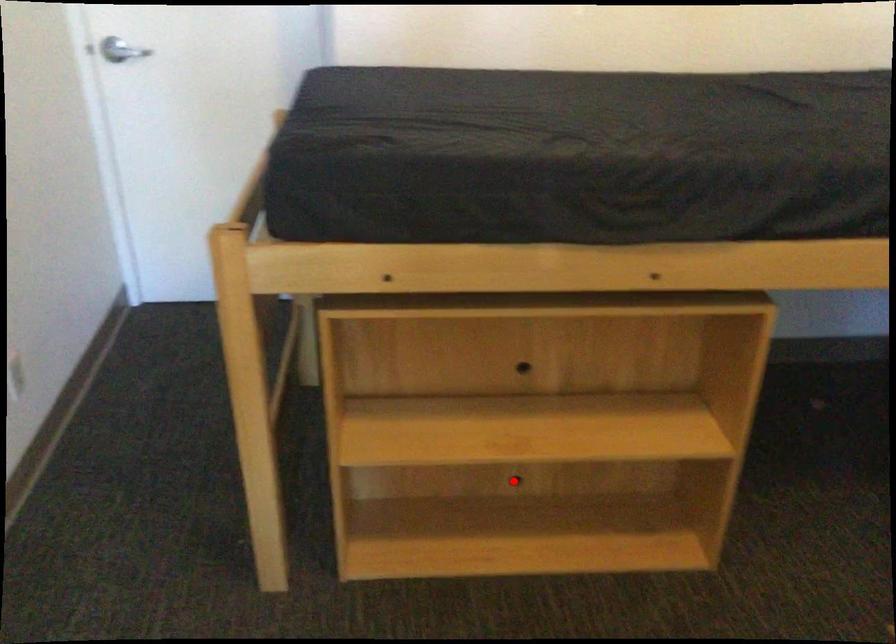
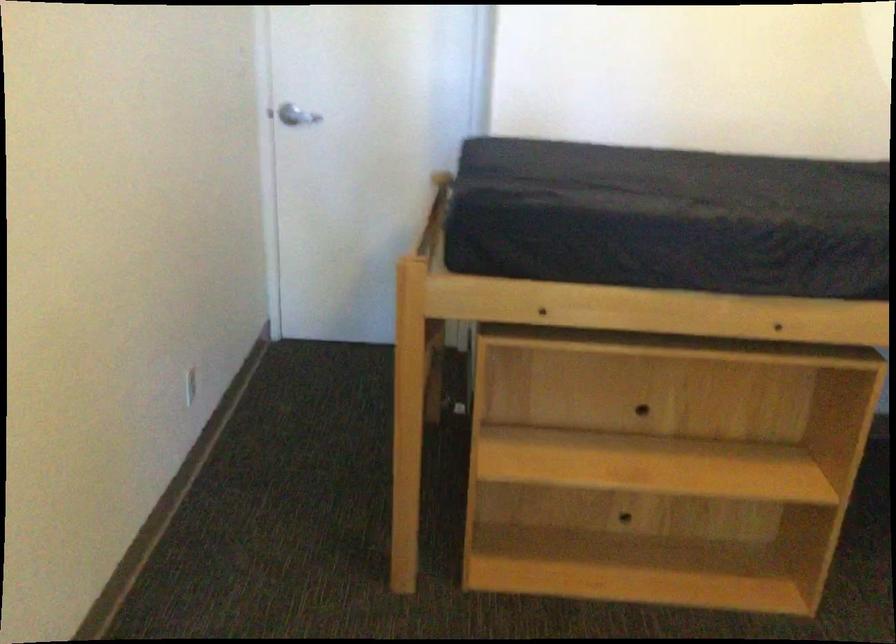
Find the pixel in the second image that matches the highlighted location in the first image.

(623, 518)